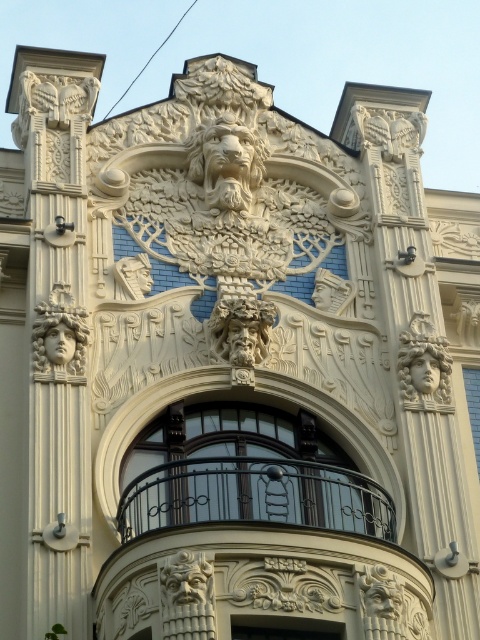
You are standing in front of the ornate architectural facade described. You need to enter through the smooth wooden door at center. Which direction should you look to see the matte stone face at center before entering?

The matte stone face at center is located above the smooth wooden door at center, so you should look upward to see it before entering.